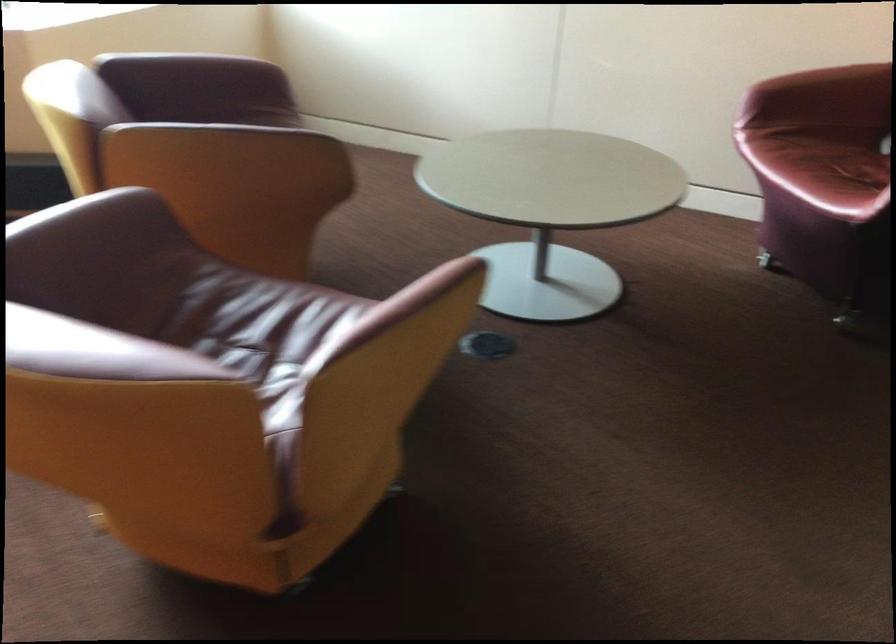
What do you see at coordinates (822, 95) in the screenshot? Image resolution: width=896 pixels, height=644 pixels. I see `a red chair armrest` at bounding box center [822, 95].